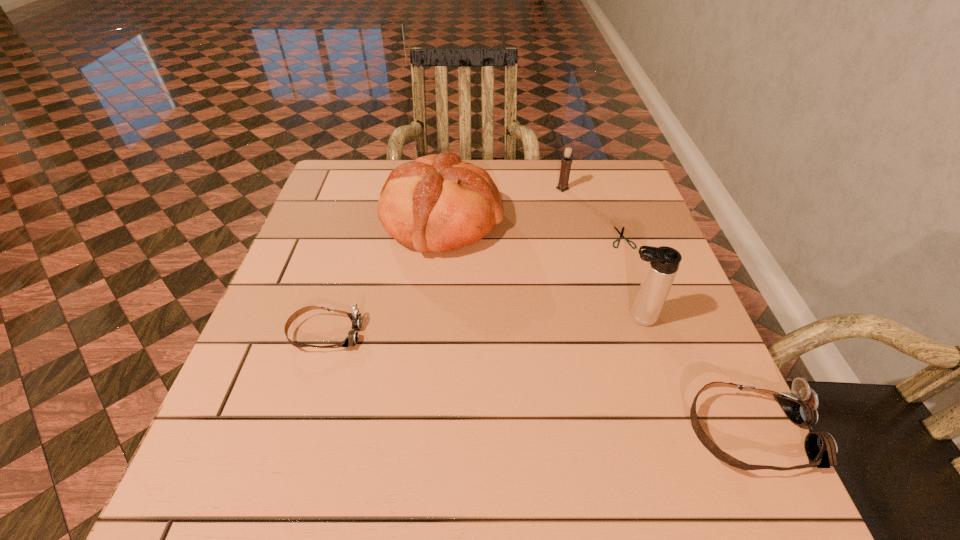
This screenshot has width=960, height=540. In order to click on vacant space located on the front of the candle holder in this screenshot , I will do `click(579, 260)`.

Locate an element on the screen. The width and height of the screenshot is (960, 540). free space located on the right of the bread is located at coordinates click(x=634, y=221).

The image size is (960, 540). Find the location of `vacant space situated 0.180m on the front of the shears`. vacant space situated 0.180m on the front of the shears is located at coordinates tap(645, 305).

Find the location of a particular element. vacant area located 0.180m on the handle side of the thermos bottle is located at coordinates (531, 318).

Find the location of `free space located 0.090m on the handle side of the thermos bottle`. free space located 0.090m on the handle side of the thermos bottle is located at coordinates [574, 318].

At what (x,y) coordinates should I click in order to perform the action: click on blank area located on the handle side of the thermos bottle. Please return your answer as a coordinate pair (x, y). Image resolution: width=960 pixels, height=540 pixels. Looking at the image, I should click on (454, 318).

You are a GUI agent. You are given a task and a screenshot of the screen. Output one action in this format:
    pyautogui.click(x=<x>, y=<y>)
    Task: Click on the candle holder that is at the far edge
    
    Given the screenshot: What is the action you would take?
    pyautogui.click(x=566, y=162)

Where is `bread present at the far edge`? bread present at the far edge is located at coordinates (437, 203).

At what (x,y) coordinates should I click in order to perform the action: click on object located at the near edge. Please return your answer as a coordinate pair (x, y). This screenshot has height=540, width=960. Looking at the image, I should click on (800, 406).

Identify the location of object located at the left edge. The width and height of the screenshot is (960, 540). (351, 340).